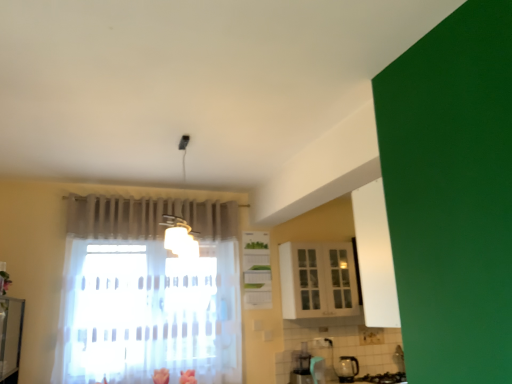
Question: Does white glossy cabinet at center, the 1th cabinetry viewed from the left, have a greater height compared to transparent glass kettle at lower right?

Choices:
 (A) yes
 (B) no

Answer: (A)

Question: Does white glossy cabinet at center, the 2th cabinetry viewed from the right, appear on the left side of transparent glass kettle at lower right?

Choices:
 (A) no
 (B) yes

Answer: (B)

Question: From the image's perspective, is white glossy cabinet at center, the 2th cabinetry viewed from the right, located above transparent glass kettle at lower right?

Choices:
 (A) no
 (B) yes

Answer: (B)

Question: Is white glossy cabinet at center, the 1th cabinetry viewed from the left, directly adjacent to transparent glass kettle at lower right?

Choices:
 (A) no
 (B) yes

Answer: (A)

Question: Does white glossy cabinet at center, the 2th cabinetry viewed from the right, have a lesser height compared to transparent glass kettle at lower right?

Choices:
 (A) no
 (B) yes

Answer: (A)

Question: Is white glossy cabinet at center, the 1th cabinetry viewed from the left, looking in the opposite direction of transparent glass kettle at lower right?

Choices:
 (A) yes
 (B) no

Answer: (B)

Question: Can you confirm if transparent glass kettle at lower right is smaller than white glossy cabinet at center, the 1th cabinetry viewed from the left?

Choices:
 (A) yes
 (B) no

Answer: (A)

Question: Can you confirm if transparent glass kettle at lower right is bigger than white glossy cabinet at center, the 2th cabinetry viewed from the right?

Choices:
 (A) yes
 (B) no

Answer: (B)

Question: Does transparent glass kettle at lower right have a lesser height compared to white glossy cabinet at center, the 1th cabinetry viewed from the left?

Choices:
 (A) yes
 (B) no

Answer: (A)

Question: Can you confirm if transparent glass kettle at lower right is taller than white glossy cabinet at center, the 2th cabinetry viewed from the right?

Choices:
 (A) no
 (B) yes

Answer: (A)

Question: Considering the relative sizes of transparent glass kettle at lower right and white glossy cabinet at center, the 2th cabinetry viewed from the right, in the image provided, is transparent glass kettle at lower right thinner than white glossy cabinet at center, the 2th cabinetry viewed from the right,?

Choices:
 (A) yes
 (B) no

Answer: (B)

Question: Is transparent glass kettle at lower right located outside white glossy cabinet at center, the 2th cabinetry viewed from the right?

Choices:
 (A) no
 (B) yes

Answer: (B)

Question: Does transparent glass kettle at lower right have a larger size compared to white glossy cabinet at upper center, acting as the first cabinetry starting from the right?

Choices:
 (A) yes
 (B) no

Answer: (B)